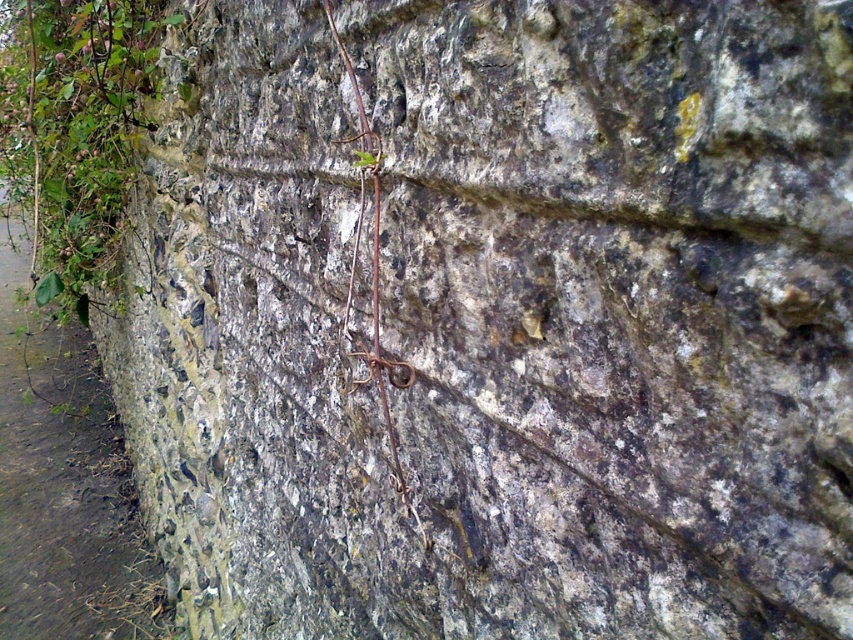
You are a gardener trying to remove the brown rough vine at center from the green mossy stone at left. Which object should you focus on first to ensure the vine is removed without damaging the stone?

You should focus on removing the brown rough vine at center first because the green mossy stone at left is bigger and less likely to be damaged during the removal process.

You are an environmental scientist assessing the growth of plants on the stone wall. You notice the green leafy plant at left and the brown rough vine at center. Which plant has a larger size according to your observation?

The green leafy plant at left is bigger than the brown rough vine at center, so the green leafy plant at left has a larger size.

You are a geologist examining the stone wall and notice a specific point marked at coordinates (65, 484). Based on the image, what type of stone is located at that point?

The point at (65, 484) corresponds to a green mossy stone at left.